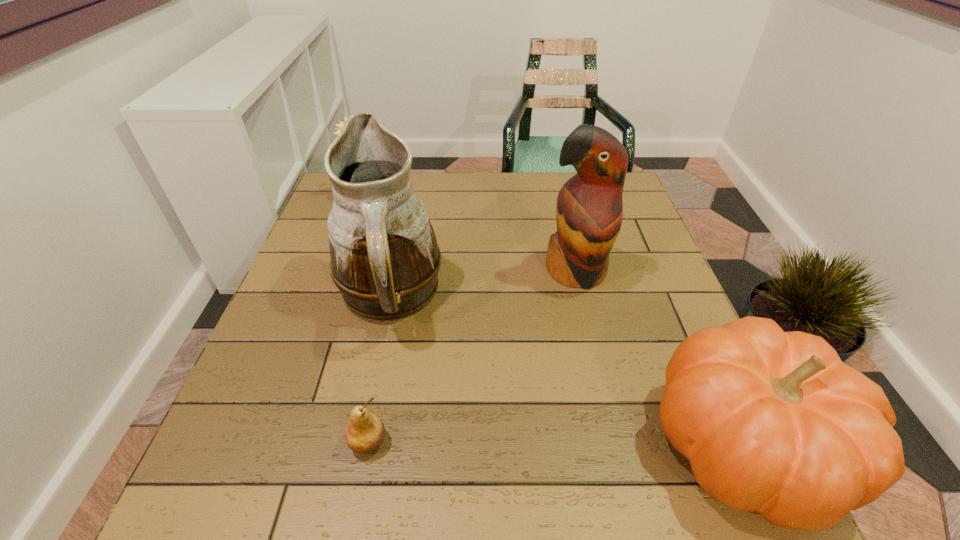
This screenshot has width=960, height=540. I want to click on free space that is in between the parrot and the shortest object, so click(471, 356).

This screenshot has height=540, width=960. Find the location of `object that can be found as the third closest to the parrot`. object that can be found as the third closest to the parrot is located at coordinates (365, 431).

Select which object is the closest to the pumpkin. Please provide its 2D coordinates. Your answer should be formatted as a tuple, i.e. [(x, y)], where the tuple contains the x and y coordinates of a point satisfying the conditions above.

[(589, 209)]